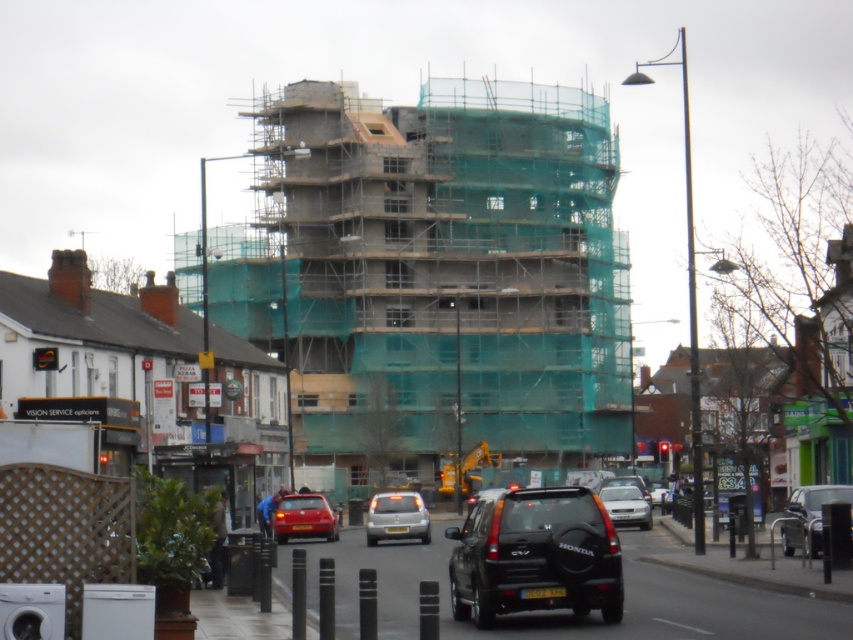
Question: Which point is farther from the camera taking this photo?

Choices:
 (A) (379, 513)
 (B) (277, 532)
 (C) (612, 488)
 (D) (817, 554)

Answer: (C)

Question: Is black matte honda suv at center positioned in front of silver metallic car at center?

Choices:
 (A) yes
 (B) no

Answer: (A)

Question: Can you confirm if black matte honda suv at center is positioned to the left of silver metallic car at center?

Choices:
 (A) no
 (B) yes

Answer: (A)

Question: Is matte black suv at center positioned before matte red car at lower center?

Choices:
 (A) yes
 (B) no

Answer: (A)

Question: Which point appears closest to the camera in this image?

Choices:
 (A) (274, 518)
 (B) (834, 490)
 (C) (627, 509)
 (D) (373, 544)

Answer: (B)

Question: Which of the following is the farthest from the observer?

Choices:
 (A) (525, 609)
 (B) (395, 496)
 (C) (788, 545)

Answer: (B)